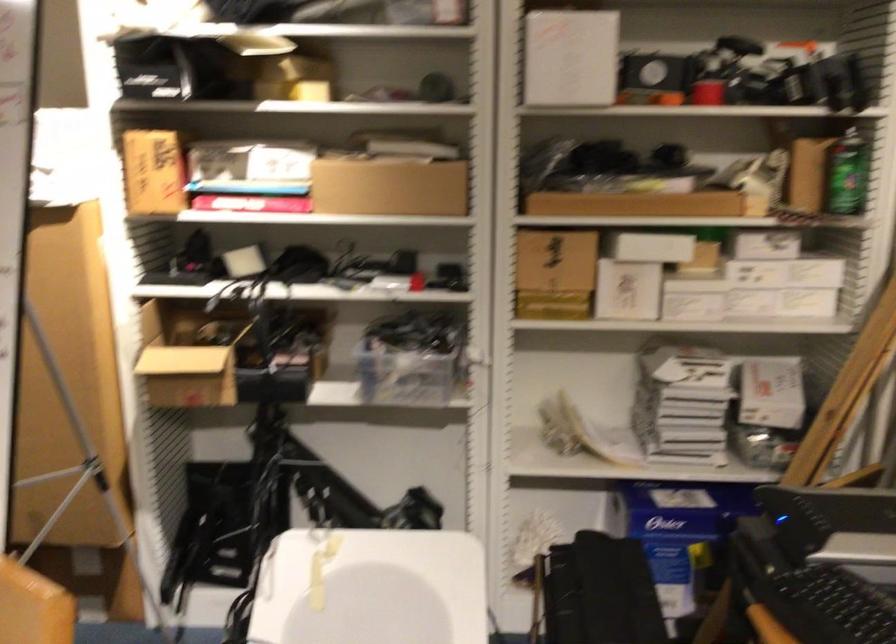
Which object does [390,187] point to?

It refers to a brown cardboard box.